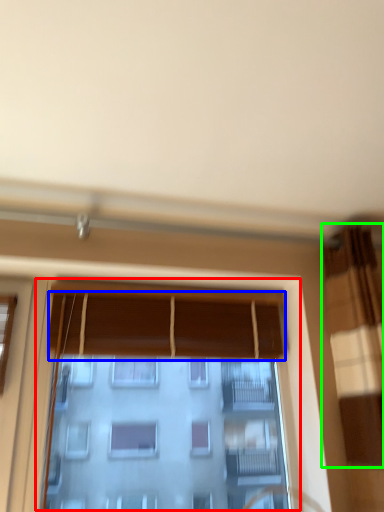
Question: Based on their relative distances, which object is farther from window (highlighted by a red box)? Choose from curtain (highlighted by a blue box) and curtain (highlighted by a green box).

Choices:
 (A) curtain
 (B) curtain

Answer: (B)